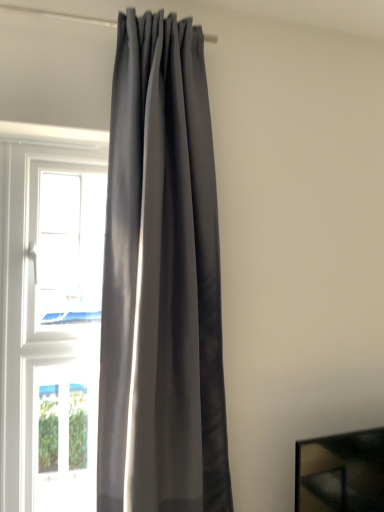
Identify the location of matte gray curtain at center. (161, 281).

Where is `transparent glass window at left, arranged as the 2th window when viewed from the top`? The height and width of the screenshot is (512, 384). transparent glass window at left, arranged as the 2th window when viewed from the top is located at coordinates (65, 436).

Find the location of `matte gray curtain at center`. matte gray curtain at center is located at coordinates (161, 281).

Is transparent glass window at left, arranged as the 2th window when viewed from the top, placed right next to matte gray curtain at center?

No, transparent glass window at left, arranged as the 2th window when viewed from the top, is not in contact with matte gray curtain at center.

How different are the orientations of transparent glass window at left, arranged as the 2th window when viewed from the top, and matte gray curtain at center in degrees?

The angular difference between transparent glass window at left, arranged as the 2th window when viewed from the top, and matte gray curtain at center is 0.00325 degrees.

Based on their positions, is transparent glass window at left, arranged as the 2th window when viewed from the top, located to the left or right of matte gray curtain at center?

Clearly, transparent glass window at left, arranged as the 2th window when viewed from the top, is on the left of matte gray curtain at center in the image.

Does transparent glass window at left, marked as the 1th window in a bottom-to-top arrangement, come behind matte gray curtain at center?

Yes, transparent glass window at left, marked as the 1th window in a bottom-to-top arrangement, is further from the viewer.

Are transparent glass window at left, arranged as the 2th window when viewed from the top, and white glossy window at left, the second window ordered from the bottom, located far from each other?

Actually, transparent glass window at left, arranged as the 2th window when viewed from the top, and white glossy window at left, the second window ordered from the bottom, are a little close together.

Which of these two, transparent glass window at left, arranged as the 2th window when viewed from the top, or white glossy window at left, the second window ordered from the bottom, is smaller?

With smaller size is transparent glass window at left, arranged as the 2th window when viewed from the top.

Consider the image. Considering the sizes of objects transparent glass window at left, marked as the 1th window in a bottom-to-top arrangement, and white glossy window at left, the second window ordered from the bottom, in the image provided, who is wider, transparent glass window at left, marked as the 1th window in a bottom-to-top arrangement, or white glossy window at left, the second window ordered from the bottom,?

white glossy window at left, the second window ordered from the bottom, is wider.

What's the angular difference between transparent glass window at left, marked as the 1th window in a bottom-to-top arrangement, and white glossy window at left, the second window ordered from the bottom,'s facing directions?

0.00573 degrees separate the facing orientations of transparent glass window at left, marked as the 1th window in a bottom-to-top arrangement, and white glossy window at left, the second window ordered from the bottom.

Considering the relative positions of white glossy window at left, the second window ordered from the bottom, and transparent glass window at left, arranged as the 2th window when viewed from the top, in the image provided, is white glossy window at left, the second window ordered from the bottom, behind transparent glass window at left, arranged as the 2th window when viewed from the top,?

No, the depth of white glossy window at left, the second window ordered from the bottom, is less than that of transparent glass window at left, arranged as the 2th window when viewed from the top.

Considering the relative sizes of white glossy window at left, the second window ordered from the bottom, and transparent glass window at left, marked as the 1th window in a bottom-to-top arrangement, in the image provided, is white glossy window at left, the second window ordered from the bottom, taller than transparent glass window at left, marked as the 1th window in a bottom-to-top arrangement,?

Yes, white glossy window at left, the second window ordered from the bottom, is taller than transparent glass window at left, marked as the 1th window in a bottom-to-top arrangement.

Does white glossy window at left, which ranks as the first window in top-to-bottom order, have a greater width compared to transparent glass window at left, marked as the 1th window in a bottom-to-top arrangement?

Yes, white glossy window at left, which ranks as the first window in top-to-bottom order, is wider than transparent glass window at left, marked as the 1th window in a bottom-to-top arrangement.

Can you see white glossy window at left, which ranks as the first window in top-to-bottom order, touching transparent glass window at left, marked as the 1th window in a bottom-to-top arrangement?

No, white glossy window at left, which ranks as the first window in top-to-bottom order, is not with transparent glass window at left, marked as the 1th window in a bottom-to-top arrangement.

How distant is white glossy window at left, the second window ordered from the bottom, from matte gray curtain at center?

15.87 inches.

Considering the relative sizes of white glossy window at left, which ranks as the first window in top-to-bottom order, and matte gray curtain at center in the image provided, is white glossy window at left, which ranks as the first window in top-to-bottom order, thinner than matte gray curtain at center?

Yes, white glossy window at left, which ranks as the first window in top-to-bottom order, is thinner than matte gray curtain at center.

Image resolution: width=384 pixels, height=512 pixels. Find the location of `the 1st window behind when counting from the matte gray curtain at center`. the 1st window behind when counting from the matte gray curtain at center is located at coordinates (70, 247).

Between white glossy window at left, which ranks as the first window in top-to-bottom order, and matte gray curtain at center, which one has less height?

white glossy window at left, which ranks as the first window in top-to-bottom order.

Consider the image. How different are the orientations of matte gray curtain at center and white glossy window at left, the second window ordered from the bottom, in degrees?

The angular difference between matte gray curtain at center and white glossy window at left, the second window ordered from the bottom, is 0.00249 degrees.

Is matte gray curtain at center placed right next to white glossy window at left, the second window ordered from the bottom?

They are not placed beside each other.

The height and width of the screenshot is (512, 384). Find the location of `the 1st window counting from the left side of the matte gray curtain at center`. the 1st window counting from the left side of the matte gray curtain at center is located at coordinates (70, 247).

Between matte gray curtain at center and transparent glass window at left, arranged as the 2th window when viewed from the top, which one has less height?

transparent glass window at left, arranged as the 2th window when viewed from the top.

Which is more to the left, matte gray curtain at center or transparent glass window at left, marked as the 1th window in a bottom-to-top arrangement?

From the viewer's perspective, transparent glass window at left, marked as the 1th window in a bottom-to-top arrangement, appears more on the left side.

From a real-world perspective, does matte gray curtain at center sit lower than transparent glass window at left, arranged as the 2th window when viewed from the top?

Incorrect, from a real-world perspective, matte gray curtain at center is higher than transparent glass window at left, arranged as the 2th window when viewed from the top.

Locate an element on the screen. curtain that appears above the transparent glass window at left, arranged as the 2th window when viewed from the top (from a real-world perspective) is located at coordinates (161, 281).

Where is `window below the white glossy window at left, which ranks as the first window in top-to-bottom order (from the image's perspective)`? The width and height of the screenshot is (384, 512). window below the white glossy window at left, which ranks as the first window in top-to-bottom order (from the image's perspective) is located at coordinates (65, 436).

In the scene shown: Considering their positions, is matte gray curtain at center positioned closer to transparent glass window at left, marked as the 1th window in a bottom-to-top arrangement, than white glossy window at left, which ranks as the first window in top-to-bottom order?

matte gray curtain at center.

Considering their positions, is white glossy window at left, the second window ordered from the bottom, positioned closer to transparent glass window at left, arranged as the 2th window when viewed from the top, than matte gray curtain at center?

Based on the image, matte gray curtain at center appears to be nearer to transparent glass window at left, arranged as the 2th window when viewed from the top.

Which object lies further to the anchor point matte gray curtain at center, transparent glass window at left, marked as the 1th window in a bottom-to-top arrangement, or white glossy window at left, which ranks as the first window in top-to-bottom order?

transparent glass window at left, marked as the 1th window in a bottom-to-top arrangement, lies further to matte gray curtain at center than the other object.

Considering their positions, is white glossy window at left, which ranks as the first window in top-to-bottom order, positioned further to matte gray curtain at center than transparent glass window at left, marked as the 1th window in a bottom-to-top arrangement?

transparent glass window at left, marked as the 1th window in a bottom-to-top arrangement, is positioned further to the anchor matte gray curtain at center.

Considering their positions, is transparent glass window at left, marked as the 1th window in a bottom-to-top arrangement, positioned further to white glossy window at left, which ranks as the first window in top-to-bottom order, than matte gray curtain at center?

transparent glass window at left, marked as the 1th window in a bottom-to-top arrangement, is further to white glossy window at left, which ranks as the first window in top-to-bottom order.

Based on their spatial positions, is matte gray curtain at center or transparent glass window at left, arranged as the 2th window when viewed from the top, further from white glossy window at left, which ranks as the first window in top-to-bottom order?

Based on the image, transparent glass window at left, arranged as the 2th window when viewed from the top, appears to be further to white glossy window at left, which ranks as the first window in top-to-bottom order.

Where is `curtain between white glossy window at left, the second window ordered from the bottom, and transparent glass window at left, marked as the 1th window in a bottom-to-top arrangement, in the vertical direction`? curtain between white glossy window at left, the second window ordered from the bottom, and transparent glass window at left, marked as the 1th window in a bottom-to-top arrangement, in the vertical direction is located at coordinates (161, 281).